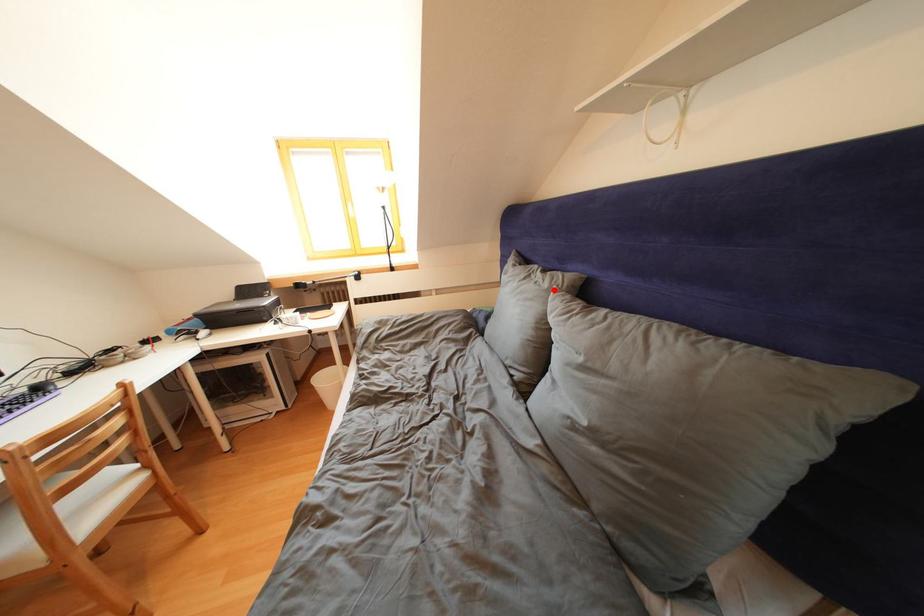
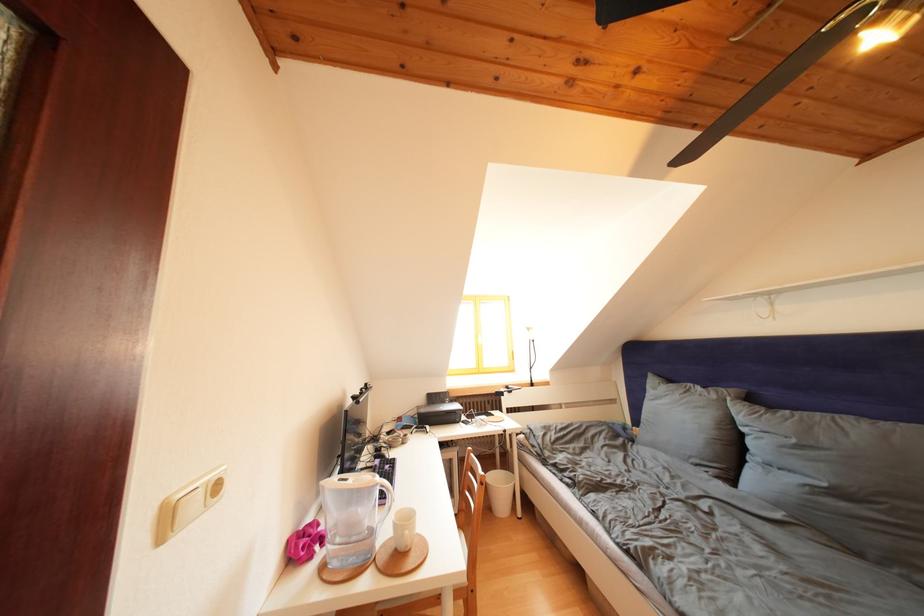
Locate, in the second image, the point that corresponds to the highlighted location in the first image.

(722, 402)